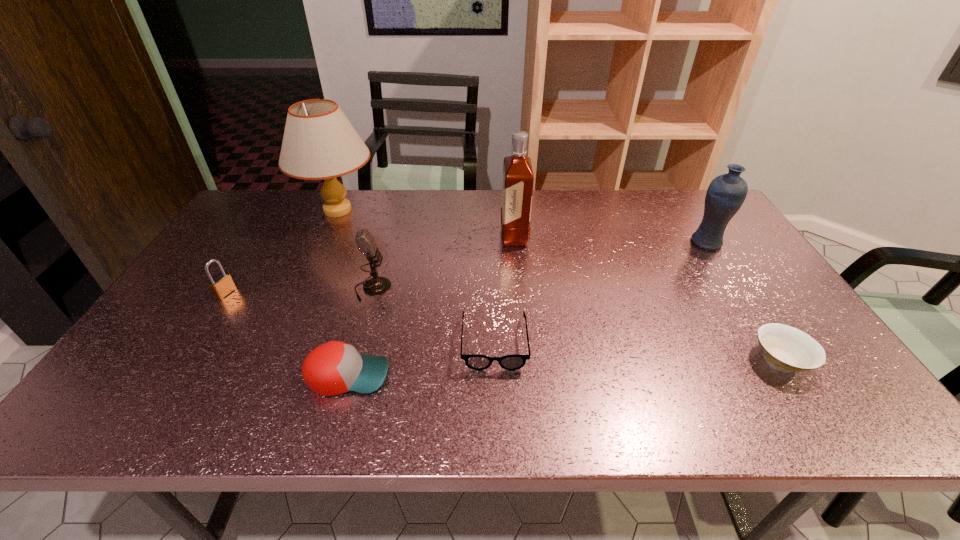
Where is `lampshade`? lampshade is located at coordinates (319, 142).

Locate an element on the screen. Image resolution: width=960 pixels, height=540 pixels. liquor is located at coordinates (518, 179).

Where is `the sixth shortest object`? the sixth shortest object is located at coordinates click(x=726, y=193).

Locate an element on the screen. The height and width of the screenshot is (540, 960). the fourth tallest object is located at coordinates (375, 286).

This screenshot has height=540, width=960. I want to click on the leftmost object, so click(x=222, y=284).

Where is `the fourth shortest object`? The image size is (960, 540). the fourth shortest object is located at coordinates (222, 284).

You are a GUI agent. You are given a task and a screenshot of the screen. Output one action in this format:
    pyautogui.click(x=<x>, y=<y>)
    Task: Click on the sixth tallest object
    
    Given the screenshot: What is the action you would take?
    pyautogui.click(x=333, y=368)

Find the location of a particular element. The height and width of the screenshot is (540, 960). bowl is located at coordinates (786, 348).

At what (x,y) coordinates should I click in order to perform the action: click on spectacles. Please return your answer as a coordinate pair (x, y). The image size is (960, 540). Looking at the image, I should click on (476, 362).

Where is `free space located 0.300m on the front of the lampshade`? free space located 0.300m on the front of the lampshade is located at coordinates (298, 300).